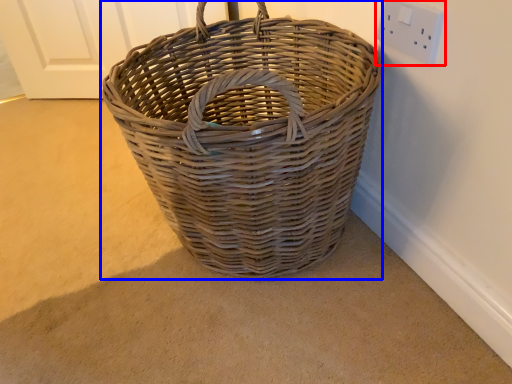
Question: Among these objects, which one is nearest to the camera, electric outlet (highlighted by a red box) or picnic basket (highlighted by a blue box)?

Choices:
 (A) electric outlet
 (B) picnic basket

Answer: (B)